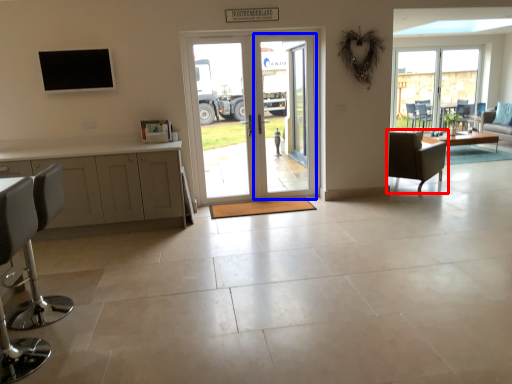
Question: Among these objects, which one is nearest to the camera, chair (highlighted by a red box) or screen door (highlighted by a blue box)?

Choices:
 (A) chair
 (B) screen door

Answer: (B)